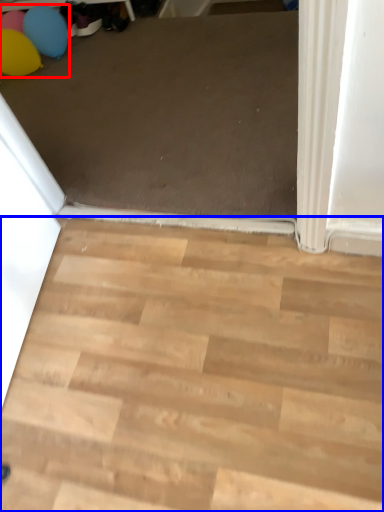
Question: Which point is further to the camera, balloon (highlighted by a red box) or stairwell (highlighted by a blue box)?

Choices:
 (A) balloon
 (B) stairwell

Answer: (A)